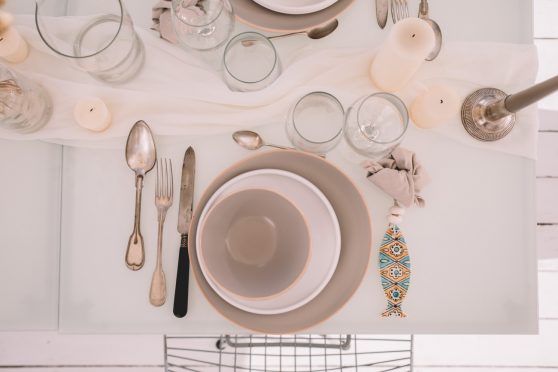
You are a GUI agent. You are given a task and a screenshot of the screen. Output one action in this format:
    pyautogui.click(x=<x>, y=<y>)
    Task: Click on the dishes
    
    Given the screenshot: What is the action you would take?
    pyautogui.click(x=299, y=230), pyautogui.click(x=322, y=229), pyautogui.click(x=351, y=225), pyautogui.click(x=287, y=21), pyautogui.click(x=291, y=3)